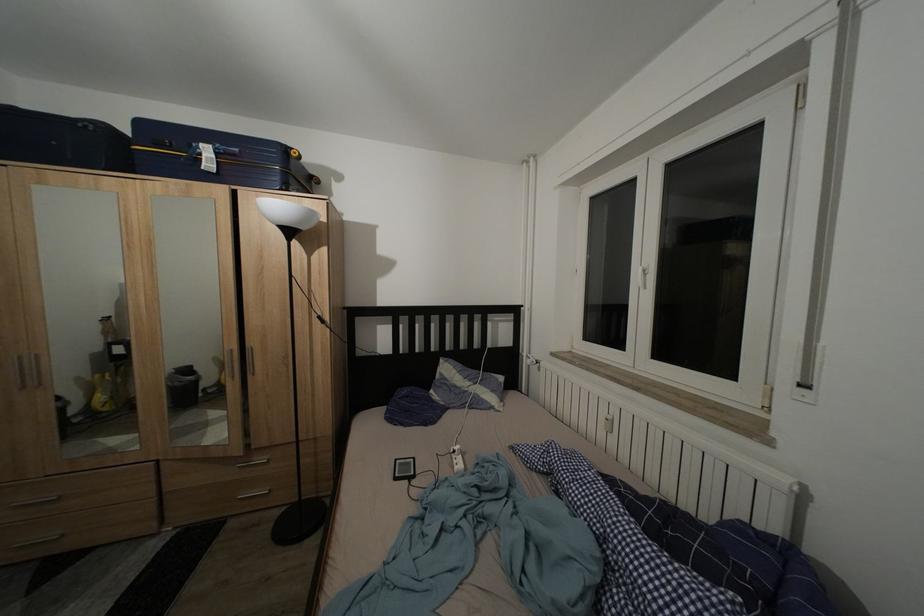
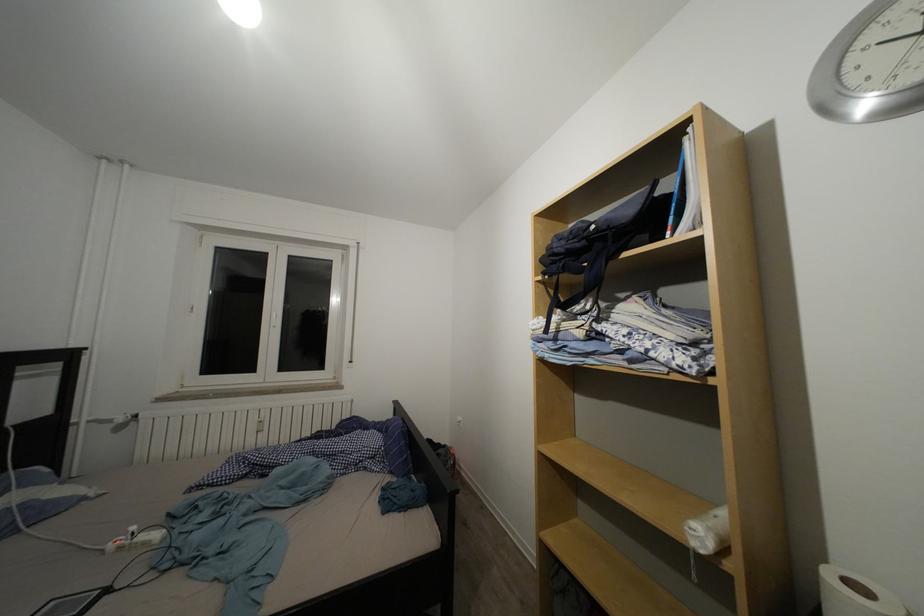
The point at (465, 454) is marked in the first image. Where is the corresponding point in the second image?

(140, 533)